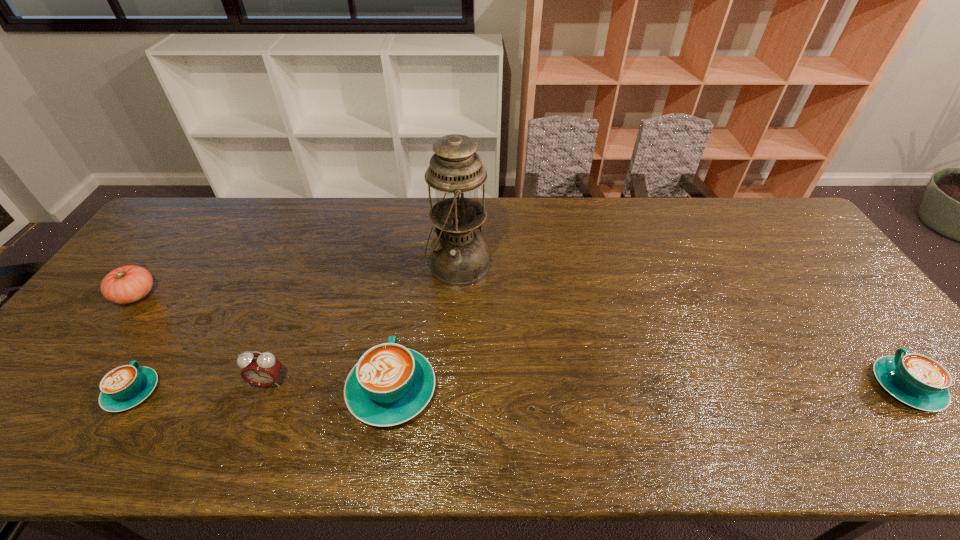
You are a GUI agent. You are given a task and a screenshot of the screen. Output one action in this format:
    pyautogui.click(x=<x>, y=<y>)
    Task: Click on the vacant position for inserting another cappuccino evenly
    This screenshot has height=540, width=960.
    Given the screenshot: What is the action you would take?
    pyautogui.click(x=650, y=388)